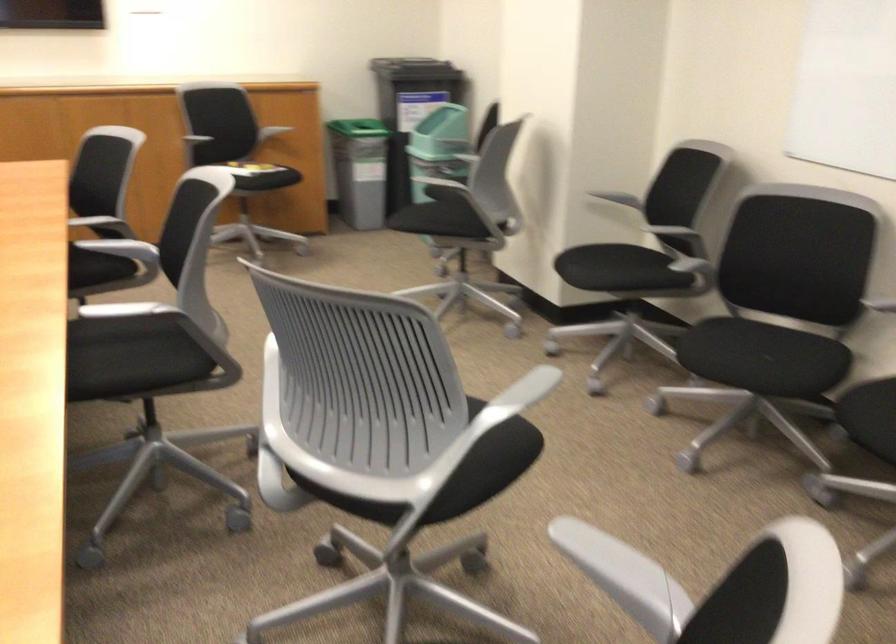
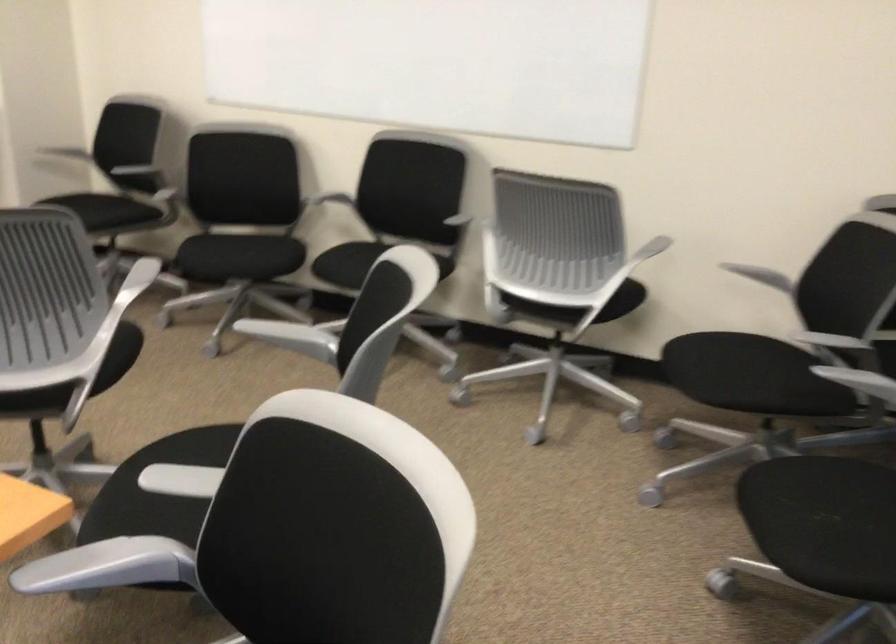
The point at (618, 192) is marked in the first image. Where is the corresponding point in the second image?

(83, 149)